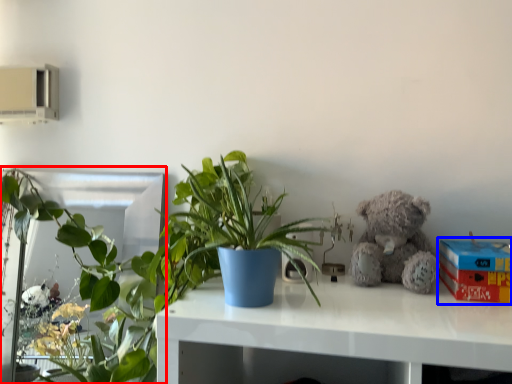
Question: Which object is further to the camera taking this photo, houseplant (highlighted by a red box) or box (highlighted by a blue box)?

Choices:
 (A) houseplant
 (B) box

Answer: (A)